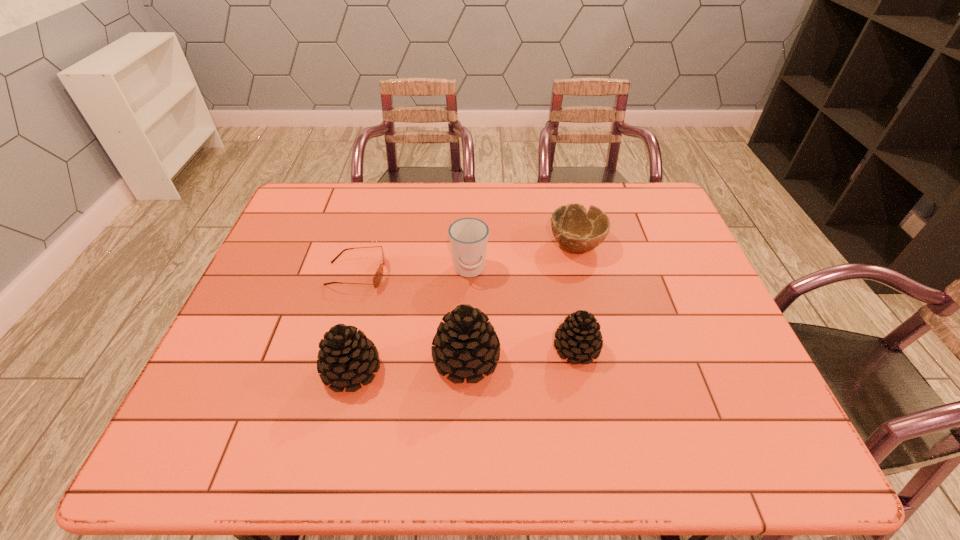
Given the evenly spaced pinecones in the image, where should an extra pinecone be added on the right to preserve the spacing? Please point to a vacant space. Please provide its 2D coordinates. Your answer should be formatted as a tuple, i.e. [(x, y)], where the tuple contains the x and y coordinates of a point satisfying the conditions above.

[(683, 338)]